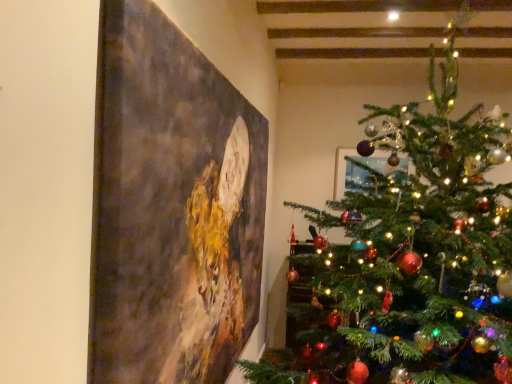
You are a GUI agent. You are given a task and a screenshot of the screen. Output one action in this format:
    pyautogui.click(x=<x>, y=<y>)
    Task: Click on the shiny metallic ornaments at right
    
    Given the screenshot: What is the action you would take?
    pyautogui.click(x=407, y=251)

In order to face shiny metallic ornaments at right, should I rotate leftwards or rightwards?

You should look right and rotate roughly 21.140 degrees.

What do you see at coordinates (407, 251) in the screenshot?
I see `shiny metallic ornaments at right` at bounding box center [407, 251].

Locate an element on the screen. This screenshot has width=512, height=384. shiny metallic ornaments at right is located at coordinates (407, 251).